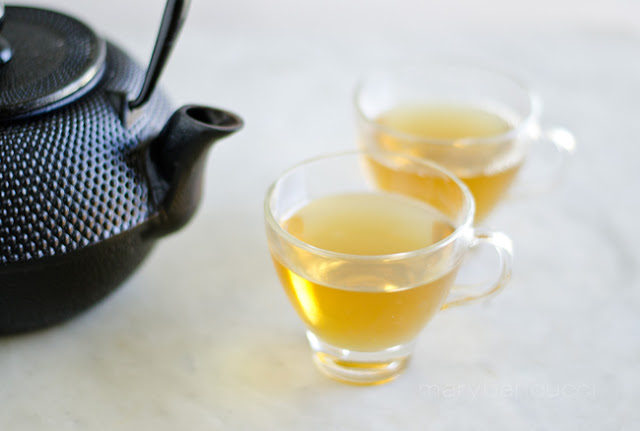
At what (x,y) coordinates should I click in order to perform the action: click on kettle. Please return your answer as a coordinate pair (x, y). Looking at the image, I should click on (102, 216).